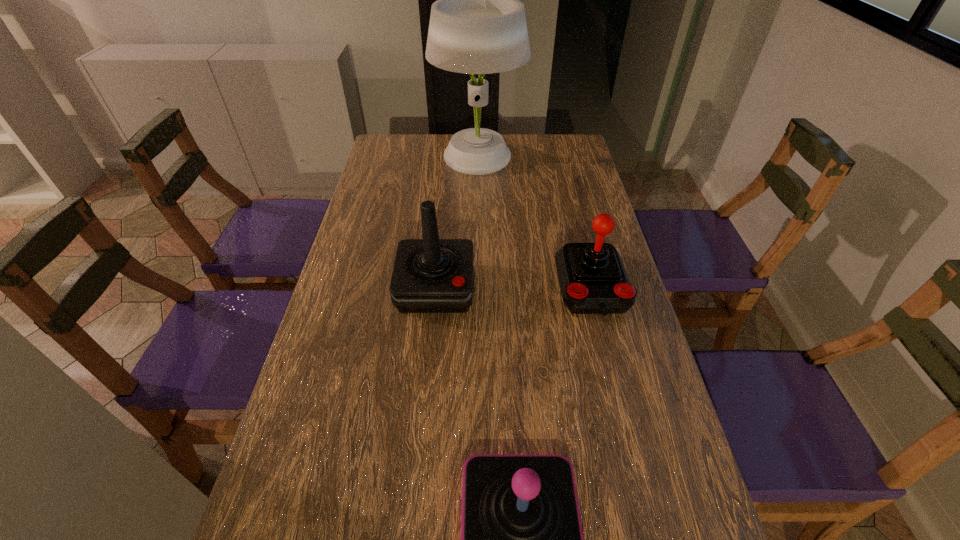
The width and height of the screenshot is (960, 540). I want to click on object that stands as the closest to the nearest joystick, so click(x=593, y=280).

Select which joystick appears as the closest to the second tallest joystick. Please provide its 2D coordinates. Your answer should be formatted as a tuple, i.e. [(x, y)], where the tuple contains the x and y coordinates of a point satisfying the conditions above.

[(430, 275)]

Identify which joystick is the second closest to the second shortest joystick. Please provide its 2D coordinates. Your answer should be formatted as a tuple, i.e. [(x, y)], where the tuple contains the x and y coordinates of a point satisfying the conditions above.

[(521, 535)]